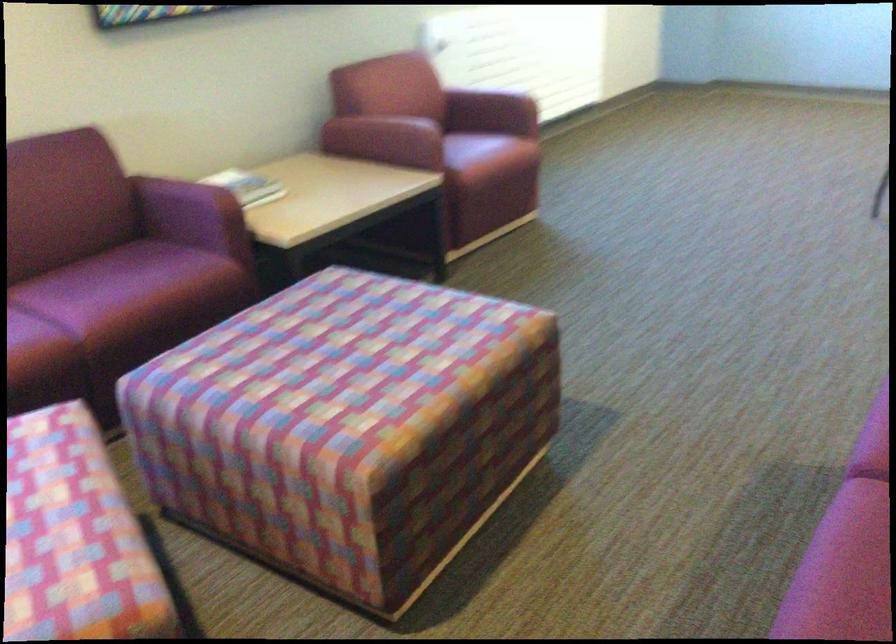
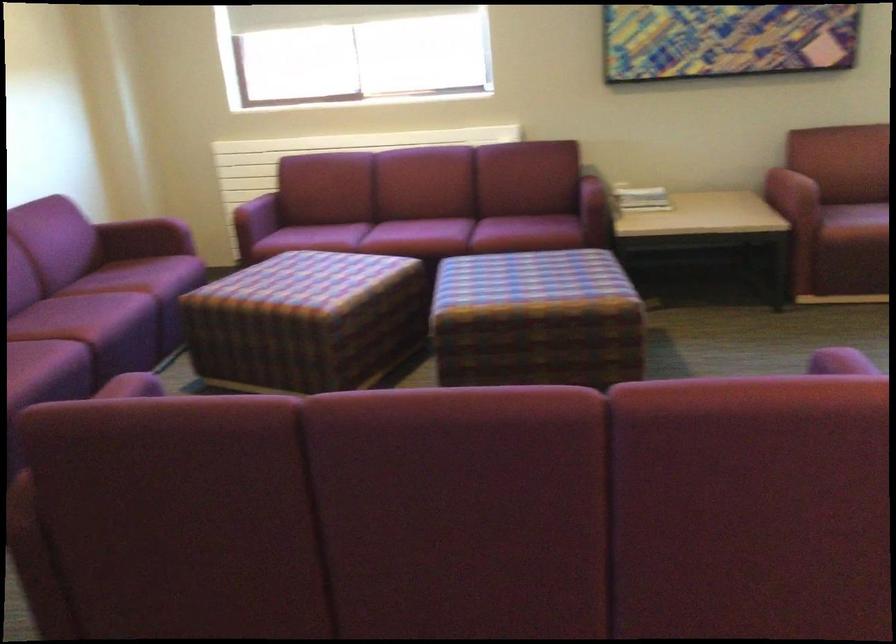
Find the pixel in the second image that matches point 259,198 in the first image.

(640, 198)